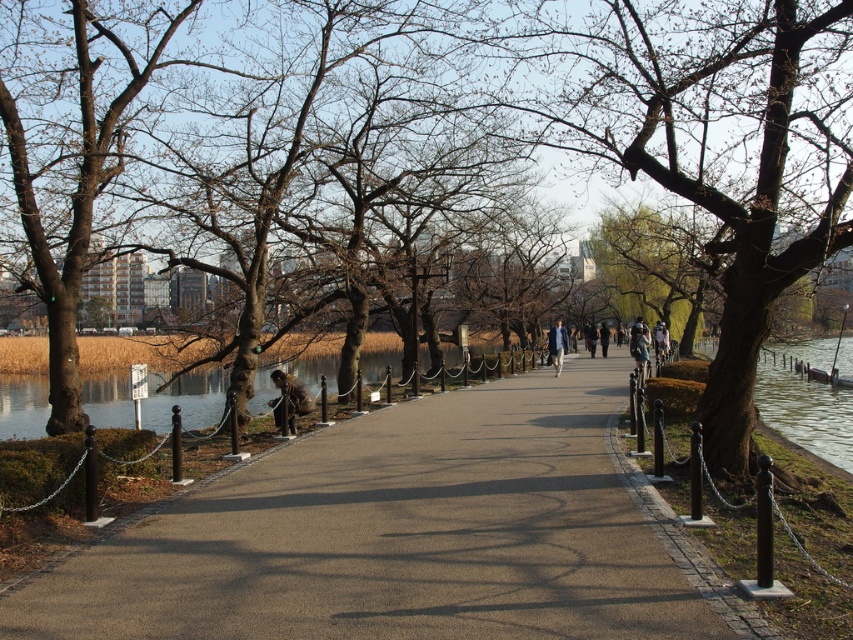
You are standing at the start of the pathway in the park and see a denim jacket at center and a blue fabric jacket at center. You want to pick up the jackets one by one. Which jacket should you pick up first to minimize the distance you have to walk?

The denim jacket at center and blue fabric jacket at center are 10.04 feet apart. To minimize walking distance, you should pick up the denim jacket at center first, then the blue fabric jacket at center since they are already separated by that distance.

You are a pedestrian walking along the pathway in the park and see both the brown leather jacket at center and the blue fabric jacket at center. Which jacket is located to the left when facing the jackets from the pathway?

The brown leather jacket at center is positioned on the left side of the blue fabric jacket at center, so when facing the jackets from the pathway, the brown leather jacket at center is to the left.

You are a park visitor carrying a large backpack and want to sit on a bench. You see a denim jacket at center and a blue fabric jacket at center lying on the bench. Which jacket should you move to make space for your backpack?

You should move the denim jacket at center because it might be wider than the blue fabric jacket at center, so removing it would create more space for your backpack.